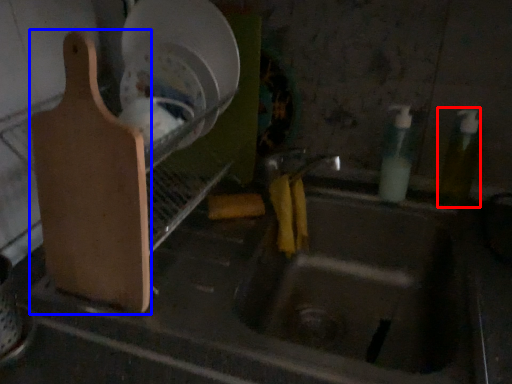
Question: Which point is further to the camera, bottle (highlighted by a red box) or cutting board (highlighted by a blue box)?

Choices:
 (A) bottle
 (B) cutting board

Answer: (A)